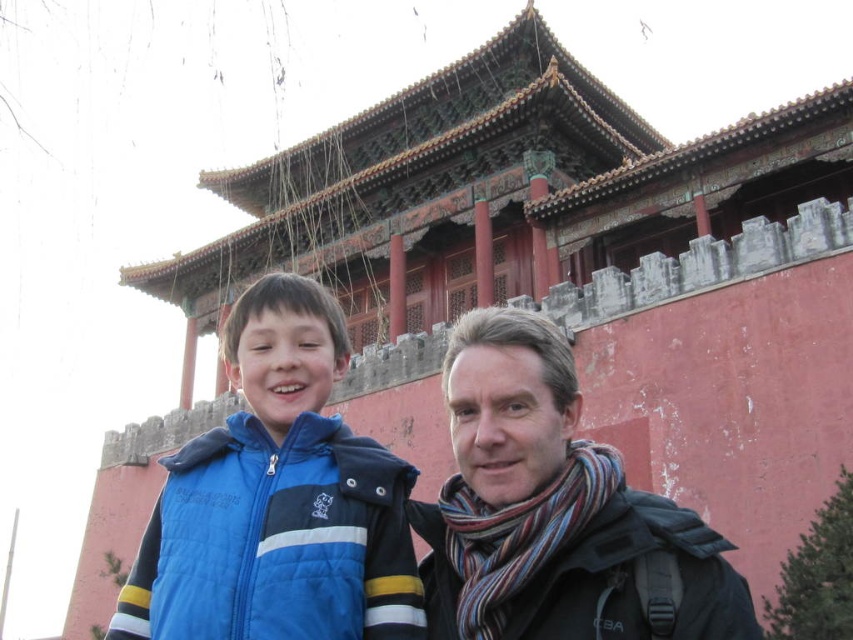
You are a photographer planning to take a group photo of the blue quilted jacket at center and the striped scarf at center. Since you want to ensure both subjects are fully visible in the frame, which one should you focus on first to adjust the camera angle?

The blue quilted jacket at center is much taller than the striped scarf at center, so you should focus on adjusting the camera angle for the blue quilted jacket at center first to ensure it fits properly in the frame.

You are planning to take a photo of the two people in front of the traditional Chinese building. To ensure both the blue quilted jacket at center and the striped scarf at center are clearly visible, which object should you focus on first?

The blue quilted jacket at center has a smaller size compared to the striped scarf at center, so you should focus on the blue quilted jacket at center first to ensure it is clearly visible.